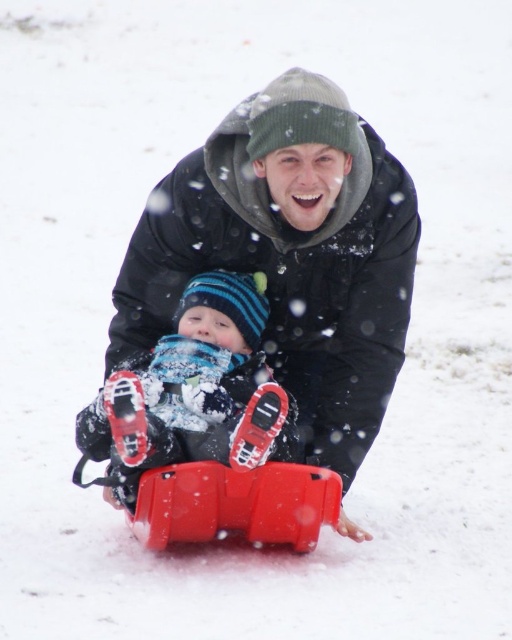
You are a photographer trying to capture a clear photo of the matte black jacket at center and the matte plastic sled at center. Since the jacket is larger, which object should you focus on first to ensure both are in focus?

The matte black jacket at center is larger than the matte plastic sled at center, so you should focus on the matte black jacket at center first to ensure both are in focus.

You are a photographer trying to capture a photo of the matte black jacket at center and the matte plastic sled at center. If you want to ensure both are fully visible in the frame, which object should you focus on first to avoid cropping?

You should focus on the matte black jacket at center first because it is much taller than the matte plastic sled at center, so it requires more space vertically to be fully captured in the photo.